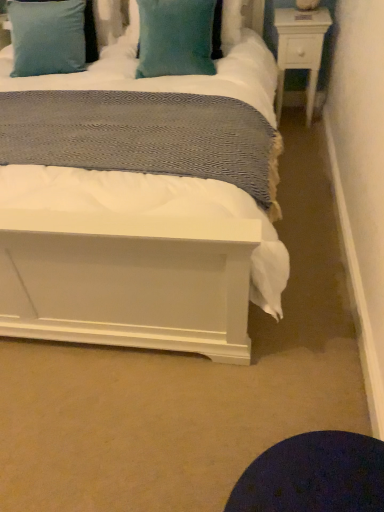
Question: From the image's perspective, is white wood nightstand at upper right located above or below teal plush pillow at upper center, placed as the 2th pillow when sorted from left to right?

Choices:
 (A) below
 (B) above

Answer: (A)

Question: Considering their positions, is white wood nightstand at upper right located in front of or behind teal plush pillow at upper center, which ranks as the first pillow in right-to-left order?

Choices:
 (A) behind
 (B) front

Answer: (A)

Question: Which of these objects is positioned closest to the teal velvet pillow at upper center, which is the 1th pillow from left to right?

Choices:
 (A) teal plush pillow at upper center, placed as the 2th pillow when sorted from left to right
 (B) white wood nightstand at upper right

Answer: (A)

Question: Based on their relative distances, which object is nearer to the teal plush pillow at upper center, which ranks as the first pillow in right-to-left order?

Choices:
 (A) white wood nightstand at upper right
 (B) teal velvet pillow at upper center, which is the 2th pillow from right to left

Answer: (B)